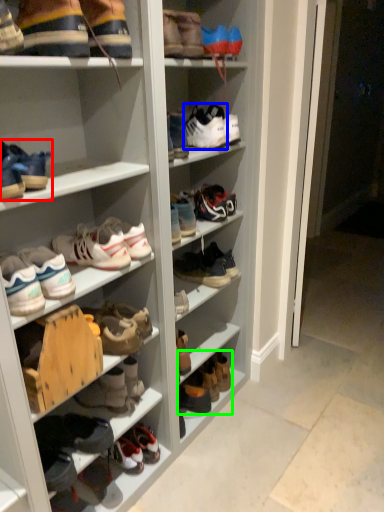
Question: Which is farther away from footwear (highlighted by a red box)? footwear (highlighted by a blue box) or footwear (highlighted by a green box)?

Choices:
 (A) footwear
 (B) footwear

Answer: (B)